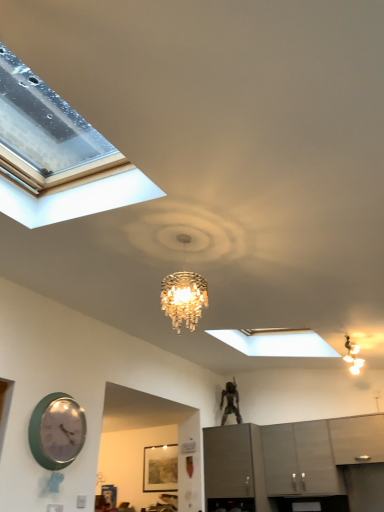
Question: Can you confirm if green glossy wall clock at lower left is shorter than wooden textured picture frame at center?

Choices:
 (A) no
 (B) yes

Answer: (A)

Question: Does green glossy wall clock at lower left turn towards wooden textured picture frame at center?

Choices:
 (A) yes
 (B) no

Answer: (B)

Question: Is green glossy wall clock at lower left positioned with its back to wooden textured picture frame at center?

Choices:
 (A) no
 (B) yes

Answer: (A)

Question: Considering the relative sizes of green glossy wall clock at lower left and wooden textured picture frame at center in the image provided, is green glossy wall clock at lower left smaller than wooden textured picture frame at center?

Choices:
 (A) no
 (B) yes

Answer: (A)

Question: Does green glossy wall clock at lower left have a greater height compared to wooden textured picture frame at center?

Choices:
 (A) yes
 (B) no

Answer: (A)

Question: From a real-world perspective, is green glossy wall clock at lower left physically below wooden textured picture frame at center?

Choices:
 (A) no
 (B) yes

Answer: (A)

Question: Is green glossy wall clock at lower left at the right side of satin gray cabinets at lower right, positioned as the second cabinetry in left-to-right order?

Choices:
 (A) yes
 (B) no

Answer: (B)

Question: Is green glossy wall clock at lower left wider than satin gray cabinets at lower right, positioned as the second cabinetry in left-to-right order?

Choices:
 (A) yes
 (B) no

Answer: (B)

Question: Can you confirm if green glossy wall clock at lower left is smaller than satin gray cabinets at lower right, positioned as the 2th cabinetry in right-to-left order?

Choices:
 (A) no
 (B) yes

Answer: (B)

Question: Is green glossy wall clock at lower left completely or partially outside of satin gray cabinets at lower right, positioned as the 2th cabinetry in right-to-left order?

Choices:
 (A) no
 (B) yes

Answer: (B)

Question: Would you say green glossy wall clock at lower left contains satin gray cabinets at lower right, positioned as the second cabinetry in left-to-right order?

Choices:
 (A) yes
 (B) no

Answer: (B)

Question: Can you confirm if green glossy wall clock at lower left is thinner than satin gray cabinets at lower right, positioned as the 2th cabinetry in right-to-left order?

Choices:
 (A) yes
 (B) no

Answer: (A)

Question: Can you confirm if satin gray cabinets at lower right, positioned as the second cabinetry in left-to-right order, is shorter than wooden textured picture frame at center?

Choices:
 (A) yes
 (B) no

Answer: (B)